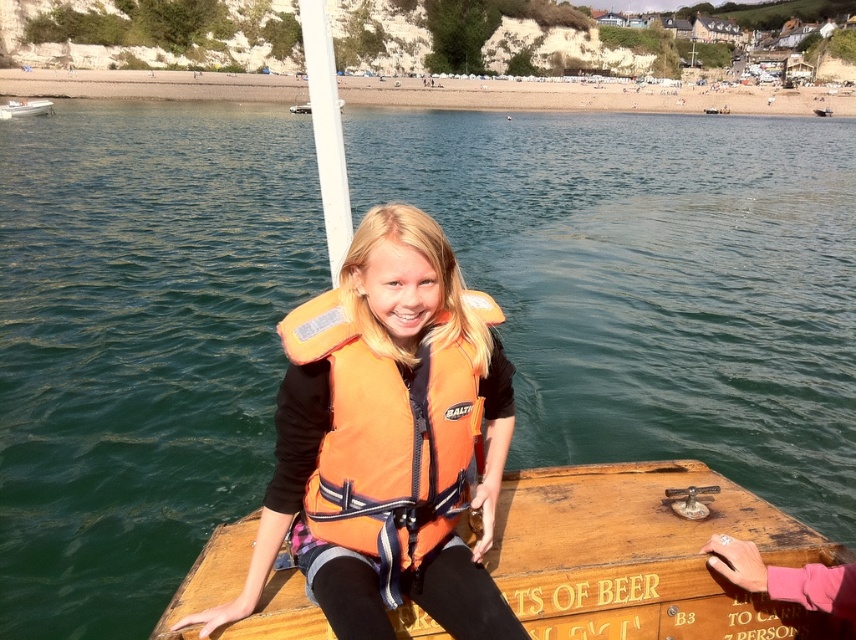
You are a photographer trying to capture the wooden raft at center and the white plastic boat at upper left in the same frame. Based on their positions, which object should you focus on first to ensure both are in the shot?

The wooden raft at center is located below the white plastic boat at upper left, so you should focus on the white plastic boat at upper left first to ensure both are in the shot.

You are a photographer trying to capture the wooden raft at center and the white plastic boat at upper left in a single shot. Which object will appear larger in your photo?

The wooden raft at center will appear larger in the photo because it is closer to the viewer than the white plastic boat at upper left.

You are planning to board a vessel that can accommodate a group of 6 people. Based on the scene, which vessel between the wooden raft at center and the white plastic boat at upper left would be more suitable for your group?

The white plastic boat at upper left is more suitable for a group of 6 people because it is longer than the wooden raft at center, providing more space for passengers.